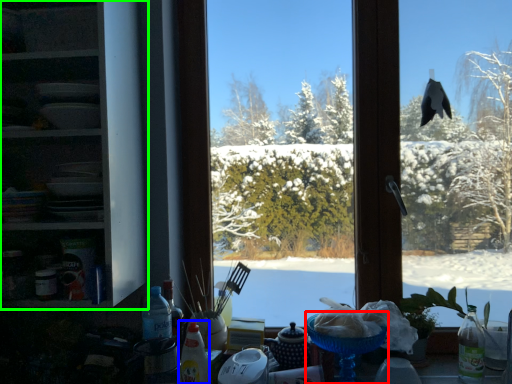
Question: Estimate the real-world distances between objects in this image. Which object is farther from tableware (highlighted by a red box), bottle (highlighted by a blue box) or shelf (highlighted by a green box)?

Choices:
 (A) bottle
 (B) shelf

Answer: (B)